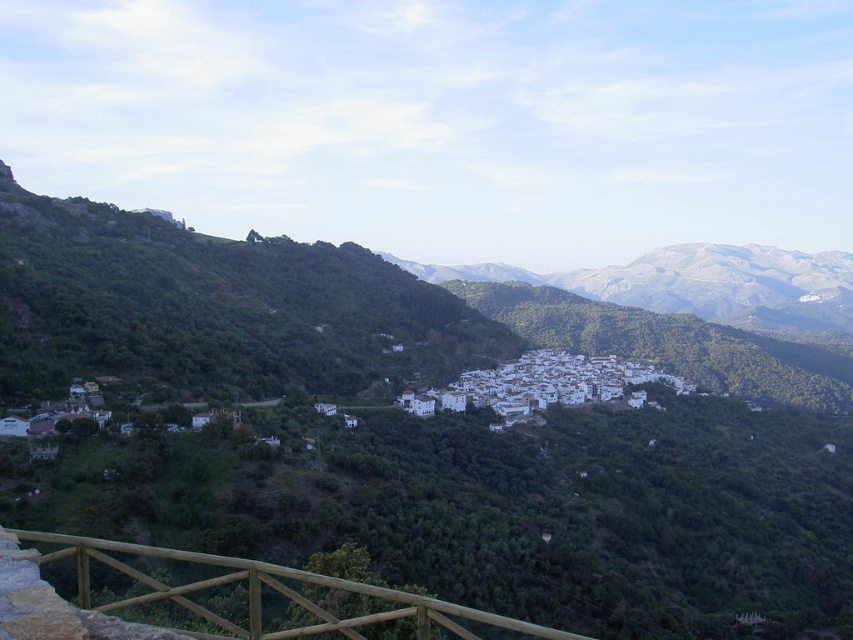
Can you confirm if brown wooden rail at lower left is positioned below white matte village at center?

Indeed, brown wooden rail at lower left is positioned under white matte village at center.

Does point (229, 563) lie in front of point (492, 390)?

Yes, it is.

What do you see at coordinates (262, 593) in the screenshot?
I see `brown wooden rail at lower left` at bounding box center [262, 593].

Locate an element on the screen. The image size is (853, 640). brown wooden rail at lower left is located at coordinates (262, 593).

Is green leafy hillside at center shorter than white matte village at center?

In fact, green leafy hillside at center may be taller than white matte village at center.

Based on the photo, is green leafy hillside at center behind white matte village at center?

No, green leafy hillside at center is closer to the viewer.

Who is more forward, (549, 586) or (492, 394)?

Point (549, 586) is more forward.

Identify the location of green leafy hillside at center. (396, 436).

Does green leafy hillside at center have a lesser width compared to brown wooden rail at lower left?

No.

Is green leafy hillside at center positioned in front of brown wooden rail at lower left?

No, green leafy hillside at center is behind brown wooden rail at lower left.

Is point (426, 358) closer to camera compared to point (62, 554)?

No, (426, 358) is behind (62, 554).

Identify the location of green leafy hillside at center. (396, 436).